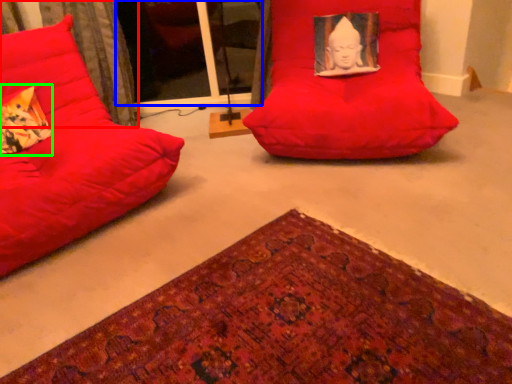
Question: Which is nearer to the curtain (highlighted by a red box)? glass door (highlighted by a blue box) or throw pillow (highlighted by a green box).

Choices:
 (A) glass door
 (B) throw pillow

Answer: (B)